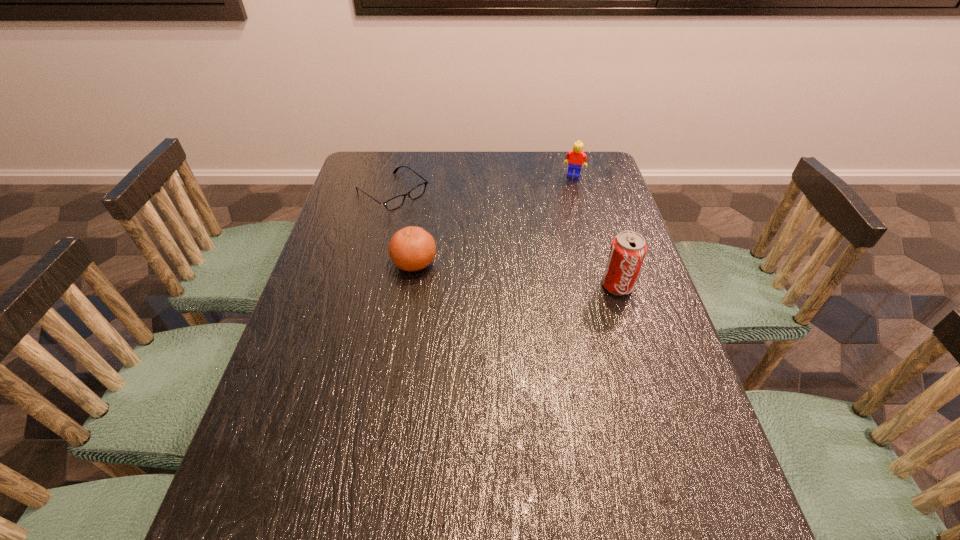
This screenshot has height=540, width=960. In order to click on free space between the third shortest object and the soda can in this screenshot , I will do `click(595, 231)`.

What are the coordinates of `free space that is in between the shortest object and the tallest object` in the screenshot? It's located at (505, 239).

Identify the location of vacant area that lies between the tallest object and the third tallest object. The image size is (960, 540). (516, 274).

You are a GUI agent. You are given a task and a screenshot of the screen. Output one action in this format:
    pyautogui.click(x=<x>, y=<y>)
    Task: Click on the object that is the closest one to the third tallest object
    The image size is (960, 540).
    Given the screenshot: What is the action you would take?
    pyautogui.click(x=397, y=201)

Choose which object is the second nearest neighbor to the soda can. Please provide its 2D coordinates. Your answer should be formatted as a tuple, i.e. [(x, y)], where the tuple contains the x and y coordinates of a point satisfying the conditions above.

[(576, 157)]

This screenshot has height=540, width=960. Find the location of `vacant space that satisfies the following two spatial constraints: 1. on the front side of the soda can; 2. on the right side of the third shortest object`. vacant space that satisfies the following two spatial constraints: 1. on the front side of the soda can; 2. on the right side of the third shortest object is located at coordinates (604, 286).

Where is `blank area in the image that satisfies the following two spatial constraints: 1. on the front side of the third tallest object; 2. on the left side of the shortest object`? blank area in the image that satisfies the following two spatial constraints: 1. on the front side of the third tallest object; 2. on the left side of the shortest object is located at coordinates (375, 263).

Find the location of a particular element. The height and width of the screenshot is (540, 960). free region that satisfies the following two spatial constraints: 1. on the front side of the second shortest object; 2. on the left side of the soda can is located at coordinates (410, 286).